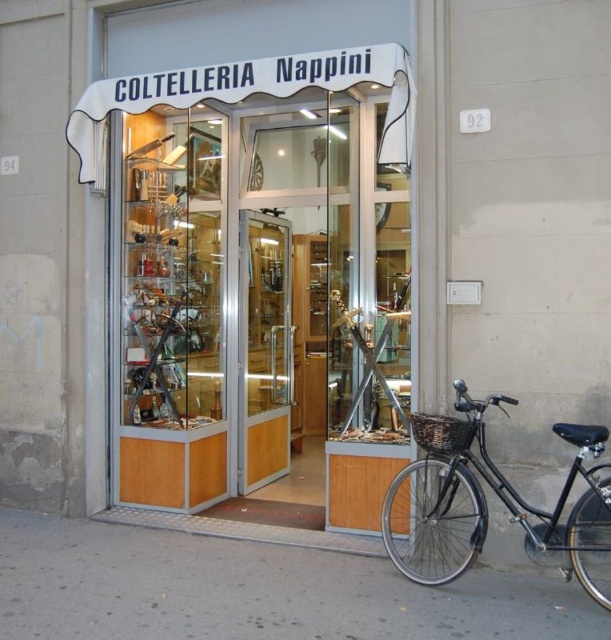
Question: Can you confirm if gray concrete pavement at lower center is positioned below black matte bicycle at lower right?

Choices:
 (A) yes
 (B) no

Answer: (A)

Question: Considering the real-world distances, which object is farthest from the gray concrete pavement at lower center?

Choices:
 (A) black matte bicycle at lower right
 (B) wooden display case at center

Answer: (B)

Question: Which point is closer to the camera taking this photo?

Choices:
 (A) (356, 630)
 (B) (208, 157)

Answer: (A)

Question: Which point appears closest to the camera in this image?

Choices:
 (A) (183, 588)
 (B) (147, 420)
 (C) (417, 509)

Answer: (A)

Question: Does gray concrete pavement at lower center come in front of black matte bicycle at lower right?

Choices:
 (A) yes
 (B) no

Answer: (A)

Question: Does wooden display case at center have a lesser width compared to gray concrete pavement at lower center?

Choices:
 (A) yes
 (B) no

Answer: (A)